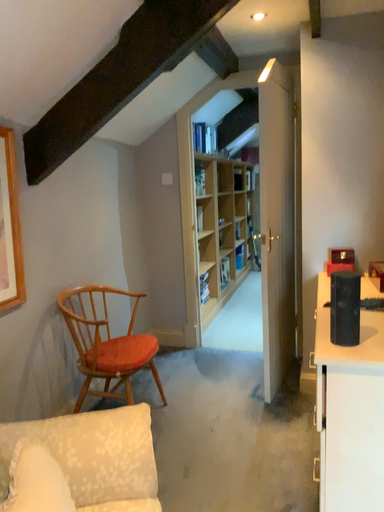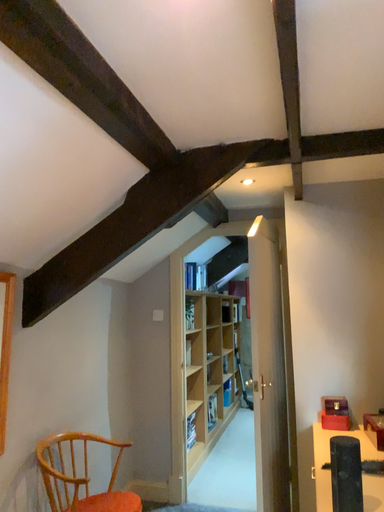
Question: Which way did the camera rotate in the video?

Choices:
 (A) rotated downward
 (B) rotated upward

Answer: (B)